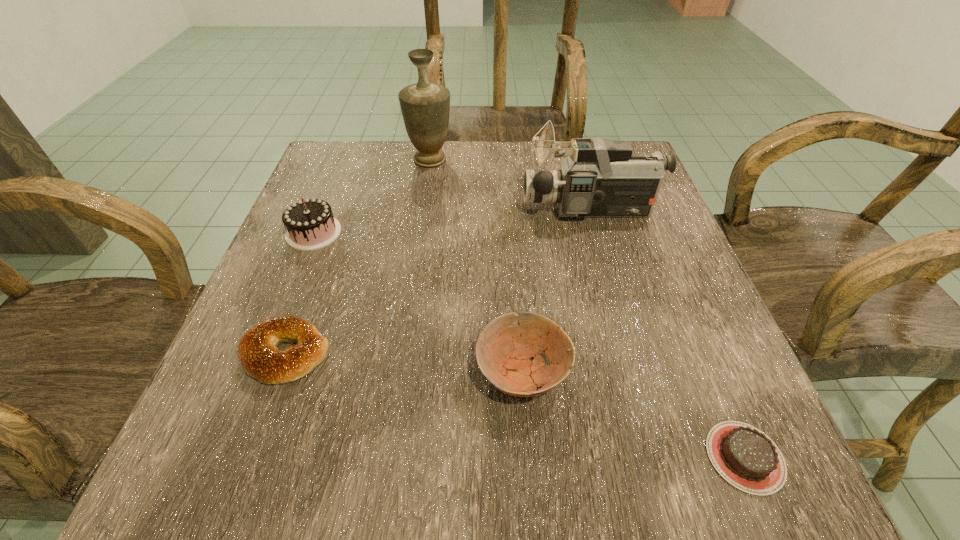
You are a GUI agent. You are given a task and a screenshot of the screen. Output one action in this format:
    pyautogui.click(x=<x>, y=<y>)
    Task: Click on the chocolate cake that is at the left edge
    
    Given the screenshot: What is the action you would take?
    coord(310,223)

The height and width of the screenshot is (540, 960). What are the coordinates of `bagel present at the left edge` in the screenshot? It's located at (257, 352).

You are a GUI agent. You are given a task and a screenshot of the screen. Output one action in this format:
    pyautogui.click(x=<x>, y=<y>)
    Task: Click on the camcorder that is positioned at the right edge
    This screenshot has height=540, width=960.
    Given the screenshot: What is the action you would take?
    pyautogui.click(x=601, y=178)

Find the location of a particular element. chocolate cake located in the right edge section of the desktop is located at coordinates (744, 456).

The image size is (960, 540). I want to click on object positioned at the far right corner, so click(601, 178).

Identify the location of object located at the near right corner. (744, 456).

Locate an element on the screen. This screenshot has height=540, width=960. vacant space at the far edge is located at coordinates (483, 160).

Image resolution: width=960 pixels, height=540 pixels. I want to click on vacant space at the near edge of the desktop, so (515, 490).

This screenshot has width=960, height=540. I want to click on vacant space at the left edge of the desktop, so click(x=329, y=199).

The height and width of the screenshot is (540, 960). Identify the location of free space at the right edge of the desktop. (640, 329).